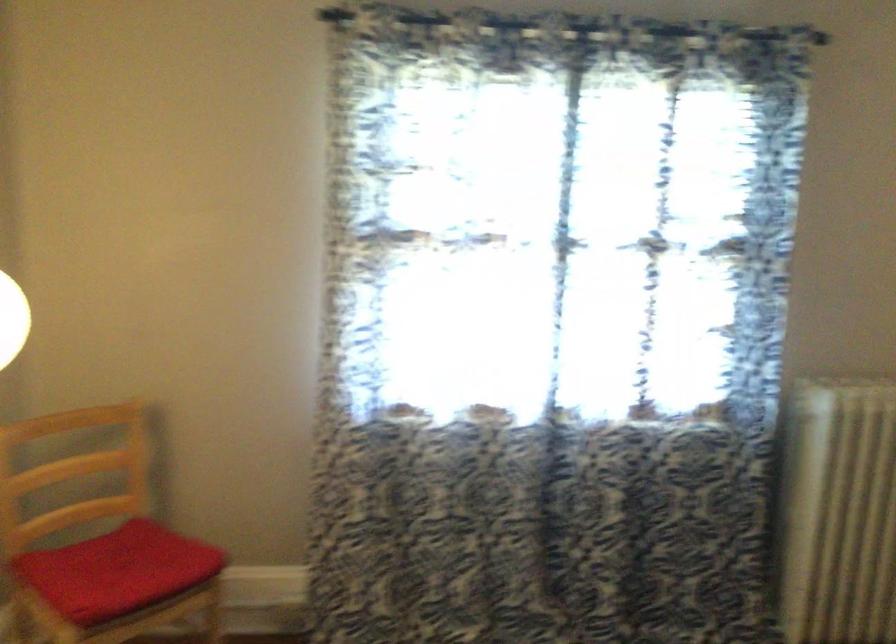
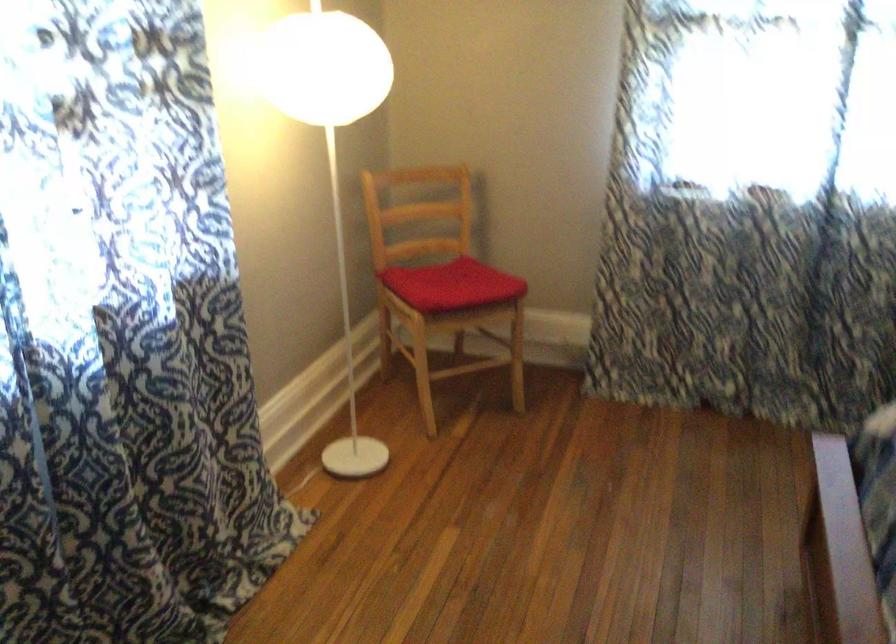
Which direction would the cameraman need to move to produce the second image?

The movement direction of the cameraman is right, backward.